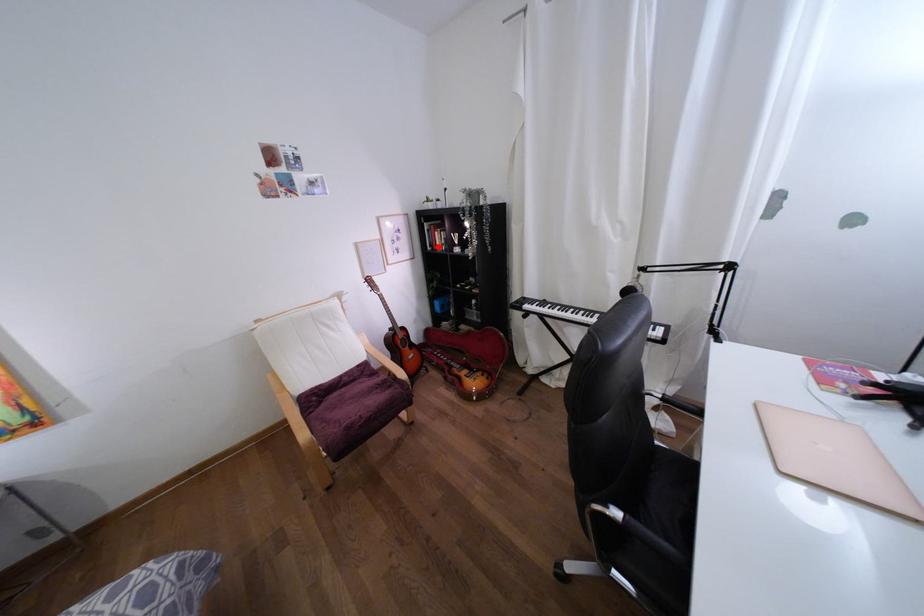
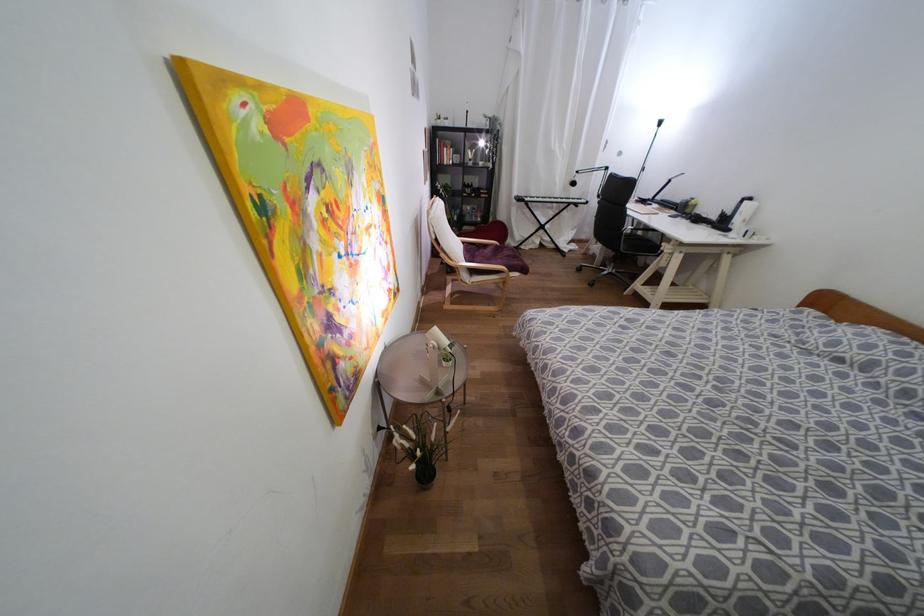
Question: I am providing you with two images of the same scene from different viewpoints. In image1, a red point is highlighted. Considering the same 3D point in image2, which of the following is correct?

Choices:
 (A) It is closer
 (B) It is farther

Answer: (A)